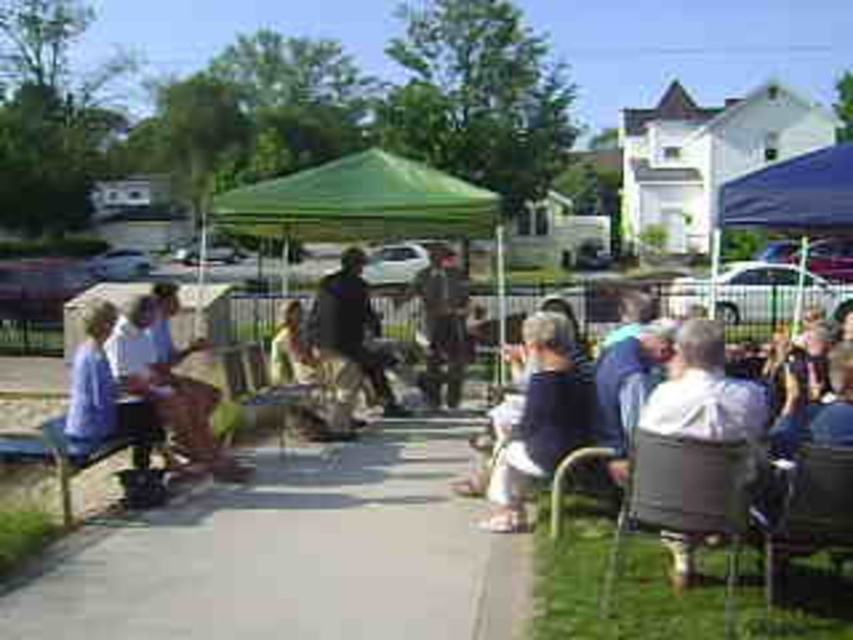
Question: Which point is farther from the camera taking this photo?

Choices:
 (A) (706, 332)
 (B) (253, 230)

Answer: (B)

Question: Observing the image, what is the correct spatial positioning of green fabric tent at center in reference to white fabric chair at lower right?

Choices:
 (A) right
 (B) left

Answer: (B)

Question: Among these objects, which one is farthest from the camera?

Choices:
 (A) wooden chair at center
 (B) gray concrete pavement at center
 (C) dark gray fabric jacket at center

Answer: (C)

Question: Is metallic gray chair at right to the right of wooden chair at center from the viewer's perspective?

Choices:
 (A) no
 (B) yes

Answer: (B)

Question: Estimate the real-world distances between objects in this image. Which object is closer to the metallic silver chair at lower right?

Choices:
 (A) green fabric tent at center
 (B) dark gray fabric jacket at center
 (C) gray concrete pavement at center

Answer: (C)

Question: Does metallic gray chair at right have a smaller size compared to wooden chair at center?

Choices:
 (A) no
 (B) yes

Answer: (B)